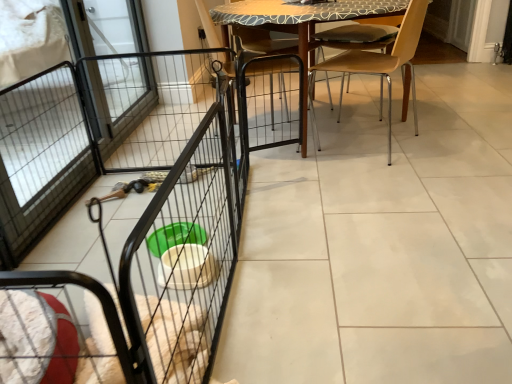
Locate an element on the screen. The image size is (512, 384). vacant space in front of light brown wood chair at center is located at coordinates (369, 173).